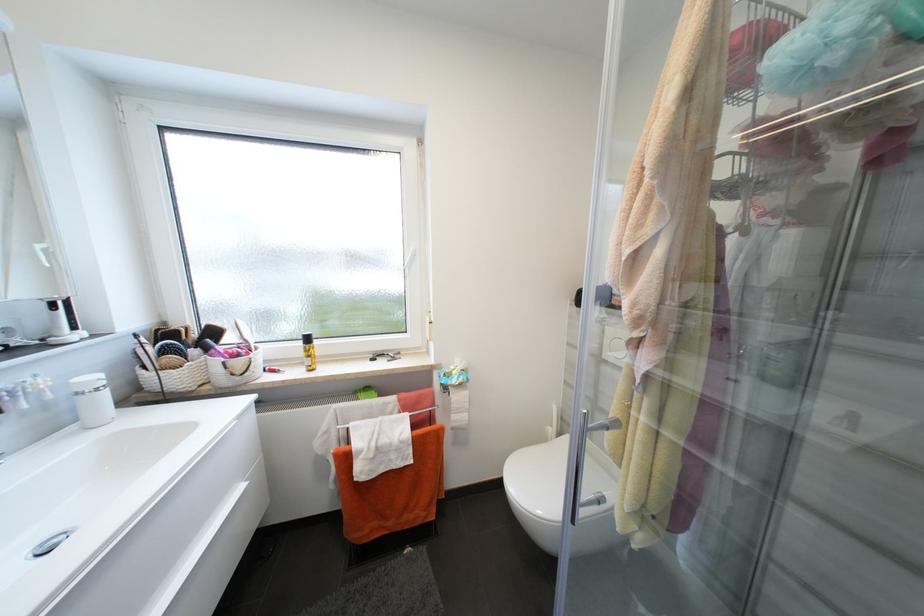
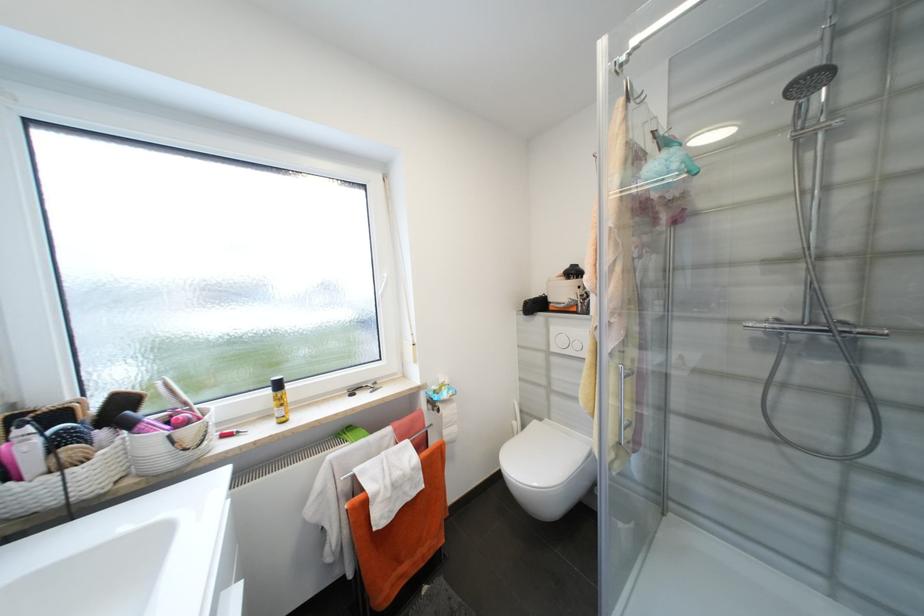
In the second image, find the point that corresponds to (853,26) in the first image.

(681, 167)